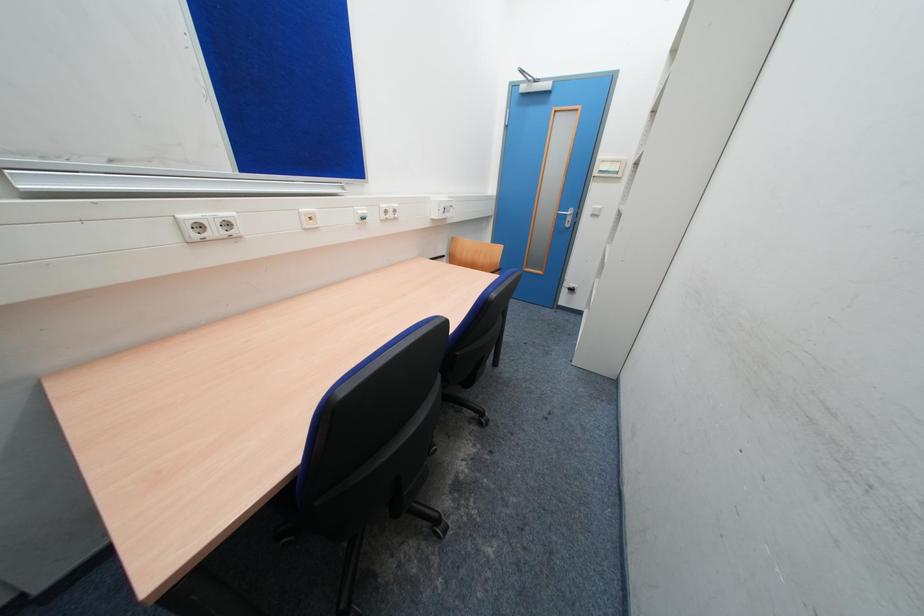
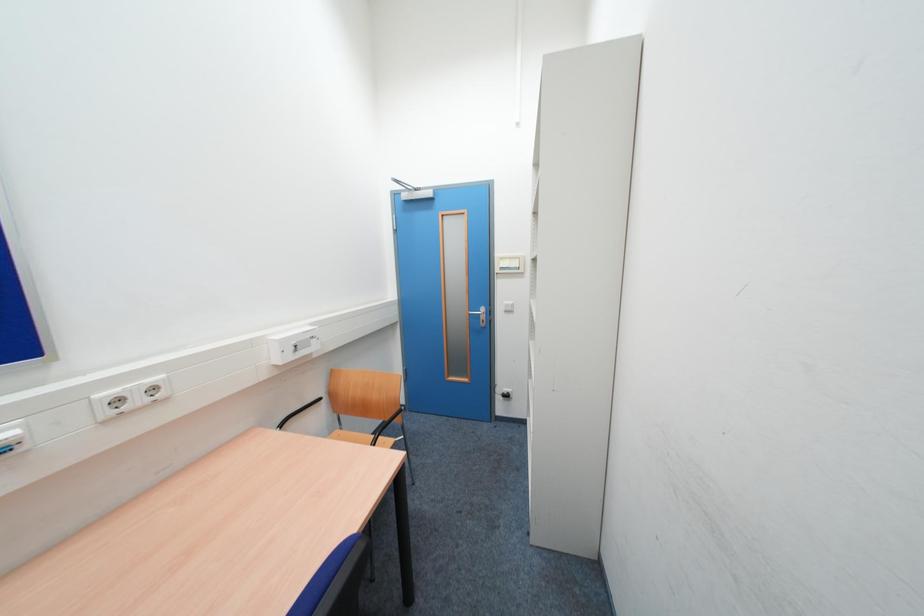
Question: The images are taken continuously from a first-person perspective. In which direction is your viewpoint rotating?

Choices:
 (A) Left
 (B) Right
 (C) Up
 (D) Down

Answer: (C)